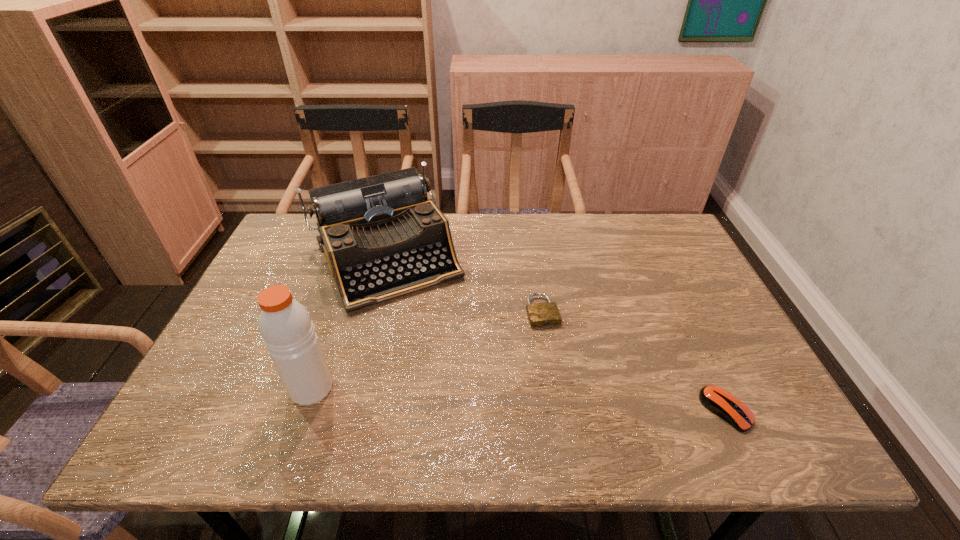
Find the location of a particular element. shaker is located at coordinates (285, 325).

The height and width of the screenshot is (540, 960). I want to click on computer mouse, so click(x=720, y=402).

At what (x,y) coordinates should I click in order to perform the action: click on the second shortest object. Please return your answer as a coordinate pair (x, y). Image resolution: width=960 pixels, height=540 pixels. Looking at the image, I should click on (720, 402).

Find the location of a particular element. This screenshot has width=960, height=540. padlock is located at coordinates (540, 314).

Find the location of a particular element. This screenshot has height=540, width=960. the shortest object is located at coordinates (540, 314).

Where is `typewriter`? typewriter is located at coordinates (382, 238).

Locate an element on the screen. This screenshot has width=960, height=540. free spot located on the back of the tallest object is located at coordinates (339, 308).

This screenshot has height=540, width=960. I want to click on free location located on the left of the computer mouse, so click(612, 410).

The image size is (960, 540). In order to click on vacant region located on the keyhole side of the second object from right to left in this screenshot , I will do `click(569, 396)`.

Where is `free space located 0.080m on the keyhole side of the second object from right to left`? Image resolution: width=960 pixels, height=540 pixels. free space located 0.080m on the keyhole side of the second object from right to left is located at coordinates (555, 353).